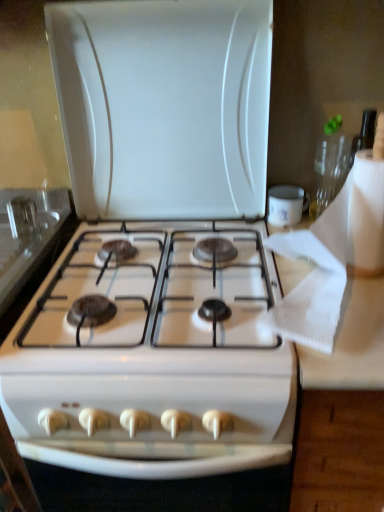
What do you see at coordinates (158, 250) in the screenshot? I see `white glossy gas stove at center` at bounding box center [158, 250].

You are a GUI agent. You are given a task and a screenshot of the screen. Output one action in this format:
    pyautogui.click(x=<x>, y=<y>)
    Task: Click on the white glossy gas stove at center
    The image size is (384, 512).
    Given the screenshot: What is the action you would take?
    pyautogui.click(x=158, y=250)

What do you see at coordinates (319, 270) in the screenshot?
I see `white paper towel at right` at bounding box center [319, 270].

The width and height of the screenshot is (384, 512). Find the location of `white paper towel at right`. white paper towel at right is located at coordinates (319, 270).

Image resolution: width=384 pixels, height=512 pixels. I want to click on white glossy gas stove at center, so click(x=158, y=250).

Can you confirm if white paper towel at right is positioned to the left of white glossy gas stove at center?

No.

Does white paper towel at right lie behind white glossy gas stove at center?

No.

Does point (326, 229) come farther from viewer compared to point (257, 291)?

No, (326, 229) is in front of (257, 291).

Based on the photo, from the image's perspective, does white paper towel at right appear higher than white glossy gas stove at center?

Correct, white paper towel at right appears higher than white glossy gas stove at center in the image.

From a real-world perspective, is white paper towel at right physically located above or below white glossy gas stove at center?

Clearly, from a real-world perspective, white paper towel at right is above white glossy gas stove at center.

Looking at their sizes, would you say white paper towel at right is wider or thinner than white glossy gas stove at center?

In the image, white paper towel at right appears to be more narrow than white glossy gas stove at center.

Does white paper towel at right have a lesser height compared to white glossy gas stove at center?

Incorrect, the height of white paper towel at right does not fall short of that of white glossy gas stove at center.

Who is bigger, white paper towel at right or white glossy gas stove at center?

Bigger between the two is white glossy gas stove at center.

Is white paper towel at right inside or outside of white glossy gas stove at center?

white paper towel at right cannot be found inside white glossy gas stove at center.

Is white paper towel at right positioned far away from white glossy gas stove at center?

No, white paper towel at right is not far from white glossy gas stove at center.

Is white paper towel at right looking in the opposite direction of white glossy gas stove at center?

That's not correct — white paper towel at right is not looking away from white glossy gas stove at center.

Can you tell me how much white paper towel at right and white glossy gas stove at center differ in facing direction?

The facing directions of white paper towel at right and white glossy gas stove at center are 0.184 degrees apart.

Measure the distance from white paper towel at right to white glossy gas stove at center.

9.87 inches.

Where is `gas stove below the white paper towel at right (from the image's perspective)`? The height and width of the screenshot is (512, 384). gas stove below the white paper towel at right (from the image's perspective) is located at coordinates (158, 250).

Which is more to the right, white glossy gas stove at center or white paper towel at right?

Positioned to the right is white paper towel at right.

In the image, is white glossy gas stove at center positioned in front of or behind white paper towel at right?

white glossy gas stove at center is positioned farther from the viewer than white paper towel at right.

Which point is more distant from viewer, (156, 465) or (301, 298)?

The point (301, 298) is farther.

From the image's perspective, is white glossy gas stove at center above white paper towel at right?

No, from the image's perspective, white glossy gas stove at center is not above white paper towel at right.

From a real-world perspective, is white glossy gas stove at center located beneath white paper towel at right?

Indeed, from a real-world perspective, white glossy gas stove at center is positioned beneath white paper towel at right.

Looking at their sizes, would you say white glossy gas stove at center is wider or thinner than white paper towel at right?

white glossy gas stove at center is wider than white paper towel at right.

Is white glossy gas stove at center shorter than white paper towel at right?

Correct, white glossy gas stove at center is not as tall as white paper towel at right.

Considering the sizes of white glossy gas stove at center and white paper towel at right in the image, is white glossy gas stove at center bigger or smaller than white paper towel at right?

Clearly, white glossy gas stove at center is larger in size than white paper towel at right.

Is white glossy gas stove at center situated inside white paper towel at right or outside?

white glossy gas stove at center is not inside white paper towel at right, it's outside.

Is white glossy gas stove at center next to white paper towel at right and touching it?

No, white glossy gas stove at center is not in contact with white paper towel at right.

Could you tell me if white glossy gas stove at center is facing white paper towel at right?

No, white glossy gas stove at center is not facing towards white paper towel at right.

What's the angular difference between white glossy gas stove at center and white paper towel at right's facing directions?

There is a 0.184-degree angle between the facing directions of white glossy gas stove at center and white paper towel at right.

This screenshot has width=384, height=512. I want to click on gas stove that is behind the white paper towel at right, so click(x=158, y=250).

Where is `gas stove on the left of white paper towel at right`? The height and width of the screenshot is (512, 384). gas stove on the left of white paper towel at right is located at coordinates (158, 250).

Identify the location of toilet paper above the white glossy gas stove at center (from the image's perspective). (319, 270).